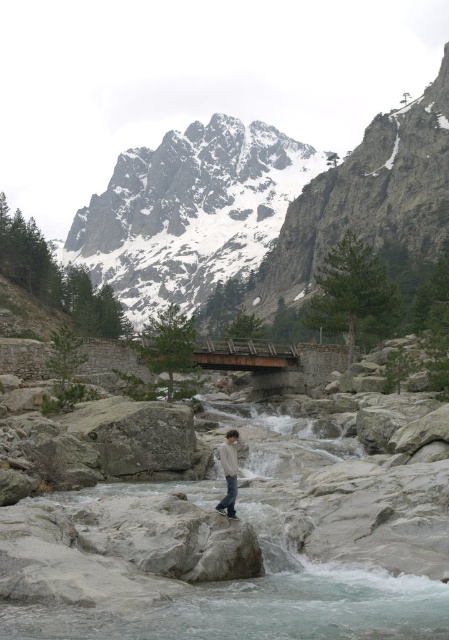
Which is more to the left, snowy granite mountain at upper center or light gray sweater at center?

From the viewer's perspective, snowy granite mountain at upper center appears more on the left side.

Measure the distance between point (162, 300) and camera.

Point (162, 300) and camera are 276.70 meters apart.

This screenshot has width=449, height=640. I want to click on snowy granite mountain at upper center, so click(x=262, y=205).